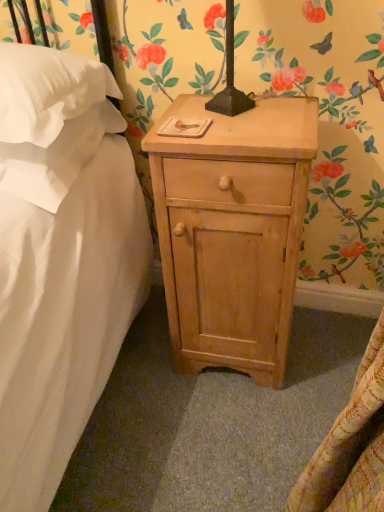
Question: Is white soft pillow at upper left, the first pillow viewed from the top, oriented towards natural wood nightstand at center?

Choices:
 (A) no
 (B) yes

Answer: (A)

Question: Is the depth of white soft pillow at upper left, which is counted as the second pillow, starting from the bottom, less than that of natural wood nightstand at center?

Choices:
 (A) yes
 (B) no

Answer: (A)

Question: Does white soft pillow at upper left, which is counted as the second pillow, starting from the bottom, have a lesser width compared to natural wood nightstand at center?

Choices:
 (A) yes
 (B) no

Answer: (B)

Question: From a real-world perspective, is white soft pillow at upper left, which is counted as the second pillow, starting from the bottom, physically below natural wood nightstand at center?

Choices:
 (A) no
 (B) yes

Answer: (A)

Question: Is white soft pillow at upper left, the first pillow viewed from the top, to the left of natural wood nightstand at center from the viewer's perspective?

Choices:
 (A) no
 (B) yes

Answer: (B)

Question: Considering the positions of white soft pillow at upper left, the first pillow viewed from the top, and natural wood nightstand at center in the image, is white soft pillow at upper left, the first pillow viewed from the top, taller or shorter than natural wood nightstand at center?

Choices:
 (A) tall
 (B) short

Answer: (B)

Question: In terms of width, does white soft pillow at upper left, which is counted as the second pillow, starting from the bottom, look wider or thinner when compared to natural wood nightstand at center?

Choices:
 (A) thin
 (B) wide

Answer: (B)

Question: Based on their positions, is white soft pillow at upper left, which is counted as the second pillow, starting from the bottom, located to the left or right of natural wood nightstand at center?

Choices:
 (A) right
 (B) left

Answer: (B)

Question: Is white soft pillow at upper left, the first pillow viewed from the top, in front of or behind natural wood nightstand at center in the image?

Choices:
 (A) front
 (B) behind

Answer: (A)

Question: From a real-world perspective, relative to natural wood nightstand at center, is white soft pillow at upper left, arranged as the first pillow when ordered from the bottom, vertically above or below?

Choices:
 (A) below
 (B) above

Answer: (B)

Question: Is point (46, 169) closer or farther from the camera than point (192, 292)?

Choices:
 (A) farther
 (B) closer

Answer: (B)

Question: From their relative heights in the image, would you say white soft pillow at upper left, the second pillow when ordered from top to bottom, is taller or shorter than natural wood nightstand at center?

Choices:
 (A) tall
 (B) short

Answer: (B)

Question: Considering their positions, is white soft pillow at upper left, the second pillow when ordered from top to bottom, located in front of or behind natural wood nightstand at center?

Choices:
 (A) behind
 (B) front

Answer: (A)

Question: Considering the positions of point (210, 240) and point (11, 69), is point (210, 240) closer or farther from the camera than point (11, 69)?

Choices:
 (A) closer
 (B) farther

Answer: (B)

Question: Is natural wood nightstand at center taller or shorter than white soft pillow at upper left, which is counted as the second pillow, starting from the bottom?

Choices:
 (A) short
 (B) tall

Answer: (B)